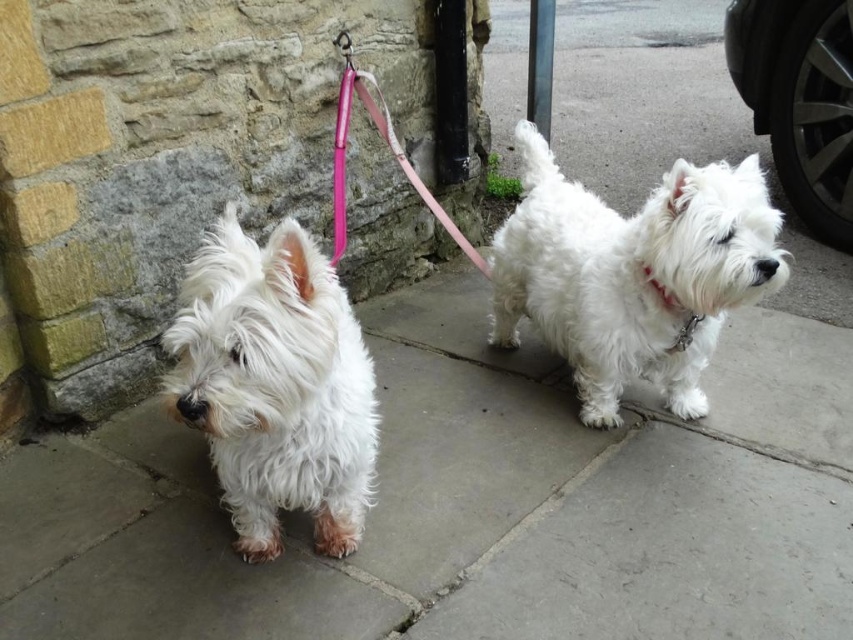
Question: Does white stone pavement at center appear on the left side of white fabric neckband at center right?

Choices:
 (A) no
 (B) yes

Answer: (B)

Question: Which point is farther to the camera?

Choices:
 (A) pink fabric leash at center
 (B) white fabric neckband at center right

Answer: (B)

Question: Does white fluffy dog at left have a larger size compared to pink fabric leash at center?

Choices:
 (A) yes
 (B) no

Answer: (B)

Question: Which point is closer to the camera?

Choices:
 (A) coord(756,253)
 (B) coord(456,470)
 (C) coord(473,259)

Answer: (A)

Question: Considering the real-world distances, which object is farthest from the pink fabric leash at center?

Choices:
 (A) white fluffy dog at left
 (B) white stone pavement at center
 (C) black rubber tire at right

Answer: (C)

Question: Is black rubber tire at right positioned at the back of pink fabric leash at center?

Choices:
 (A) yes
 (B) no

Answer: (A)